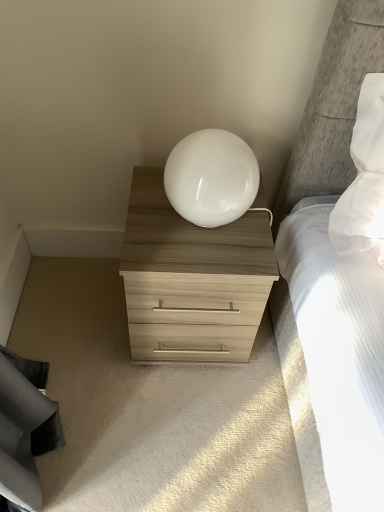
Question: From the image's perspective, is white glossy sphere at center located beneath light wood/texture chest of drawers at center?

Choices:
 (A) yes
 (B) no

Answer: (B)

Question: Is white glossy sphere at center thinner than light wood/texture chest of drawers at center?

Choices:
 (A) no
 (B) yes

Answer: (B)

Question: Is white glossy sphere at center facing away from light wood/texture chest of drawers at center?

Choices:
 (A) yes
 (B) no

Answer: (B)

Question: Is white glossy sphere at center wider than light wood/texture chest of drawers at center?

Choices:
 (A) yes
 (B) no

Answer: (B)

Question: Considering the relative positions of white glossy sphere at center and light wood/texture chest of drawers at center in the image provided, is white glossy sphere at center to the left of light wood/texture chest of drawers at center from the viewer's perspective?

Choices:
 (A) no
 (B) yes

Answer: (A)

Question: Is white glossy sphere at center closer to camera compared to light wood/texture chest of drawers at center?

Choices:
 (A) yes
 (B) no

Answer: (A)

Question: From a real-world perspective, is light wood/texture chest of drawers at center positioned under white glossy sphere at center based on gravity?

Choices:
 (A) yes
 (B) no

Answer: (A)

Question: Would you say light wood/texture chest of drawers at center is a long distance from white glossy sphere at center?

Choices:
 (A) no
 (B) yes

Answer: (A)

Question: Can you confirm if light wood/texture chest of drawers at center is smaller than white glossy sphere at center?

Choices:
 (A) no
 (B) yes

Answer: (A)

Question: Does light wood/texture chest of drawers at center have a greater height compared to white glossy sphere at center?

Choices:
 (A) yes
 (B) no

Answer: (A)

Question: Is light wood/texture chest of drawers at center behind white glossy sphere at center?

Choices:
 (A) no
 (B) yes

Answer: (B)

Question: Is light wood/texture chest of drawers at center shorter than white glossy sphere at center?

Choices:
 (A) no
 (B) yes

Answer: (A)

Question: Looking at their shapes, would you say light wood/texture chest of drawers at center is wider or thinner than white glossy sphere at center?

Choices:
 (A) thin
 (B) wide

Answer: (B)